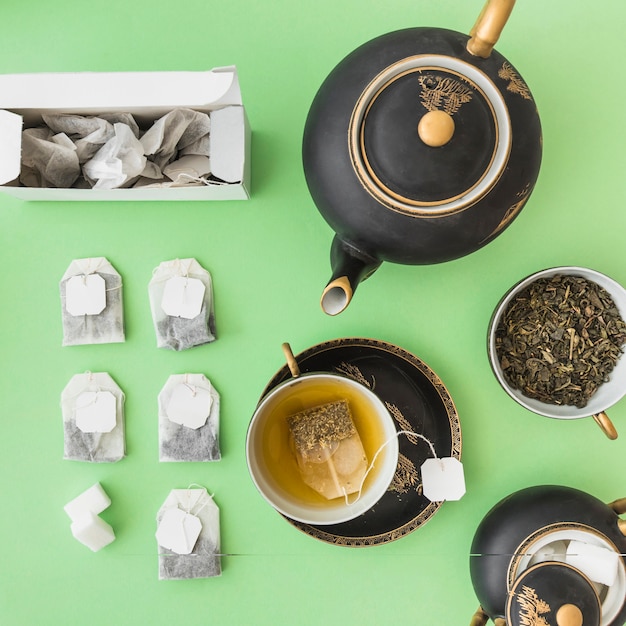
Find the location of a particular element. sugar pot is located at coordinates (546, 514).